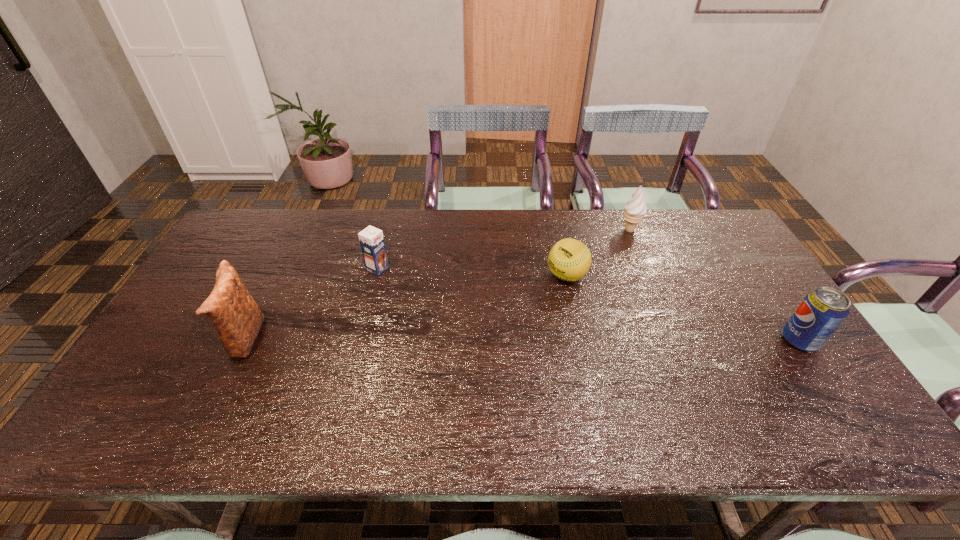
I want to click on object that is the fourth nearest to the shortest object, so click(235, 315).

At what (x,y) coordinates should I click in order to perform the action: click on vacant area that satisfies the following two spatial constraints: 1. on the front side of the chocolate milk; 2. on the right side of the soda. Please return your answer as a coordinate pair (x, y). The width and height of the screenshot is (960, 540). Looking at the image, I should click on (359, 340).